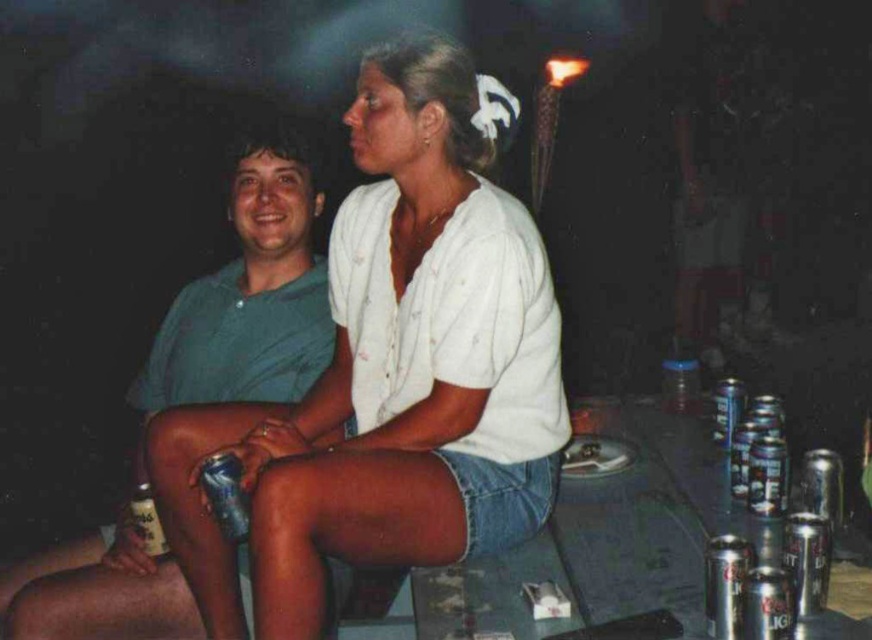
Question: Does green matte shirt at left appear on the left side of silver metallic can at lower left?

Choices:
 (A) yes
 (B) no

Answer: (A)

Question: Can you confirm if white cotton shirt at center is positioned below silver metallic can at lower left?

Choices:
 (A) no
 (B) yes

Answer: (A)

Question: Which object is the closest to the silver metallic can at lower left?

Choices:
 (A) green matte shirt at left
 (B) white cotton shirt at center

Answer: (B)

Question: Estimate the real-world distances between objects in this image. Which object is farther from the green matte shirt at left?

Choices:
 (A) silver metallic can at lower left
 (B) white cotton shirt at center

Answer: (A)

Question: Which of the following is the closest to the observer?

Choices:
 (A) white cotton shirt at center
 (B) green matte shirt at left
 (C) silver metallic can at lower left

Answer: (A)

Question: Is green matte shirt at left further to camera compared to silver metallic can at lower left?

Choices:
 (A) yes
 (B) no

Answer: (A)